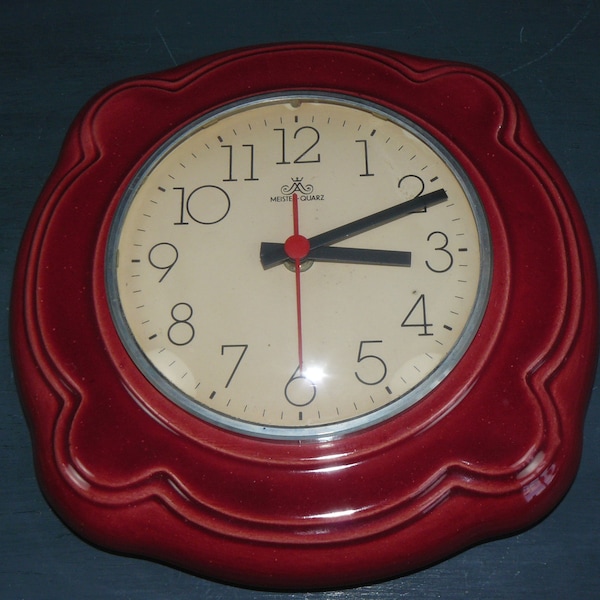
Where is `wall`? Image resolution: width=600 pixels, height=600 pixels. wall is located at coordinates (543, 580).